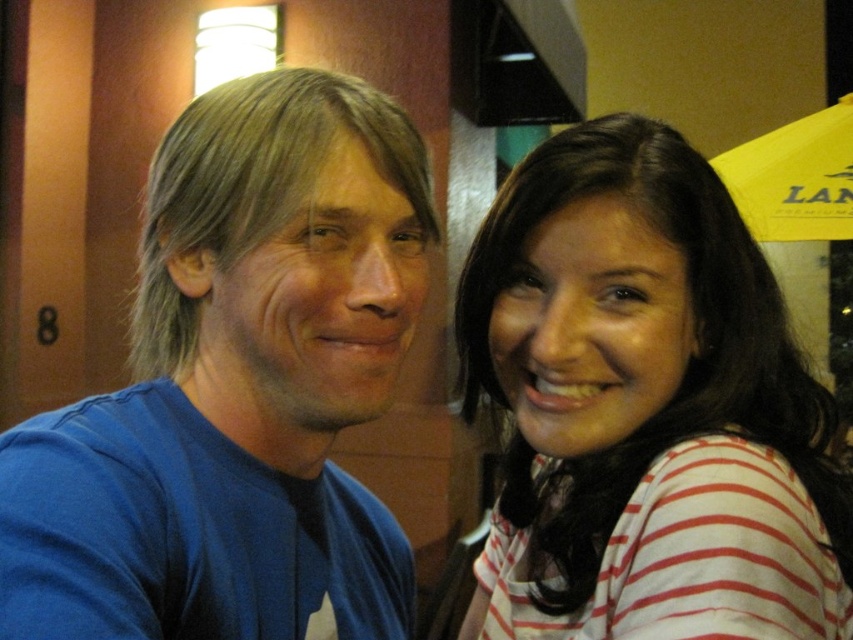
Question: Is blue cotton shirt at left to the left of white striped shirt at right from the viewer's perspective?

Choices:
 (A) no
 (B) yes

Answer: (B)

Question: Which point is closer to the camera?

Choices:
 (A) yellow fabric umbrella at upper right
 (B) blue cotton shirt at left

Answer: (B)

Question: Which point is closer to the camera?

Choices:
 (A) (283, 532)
 (B) (589, 444)

Answer: (A)

Question: Considering the relative positions of blue cotton shirt at left and yellow fabric umbrella at upper right in the image provided, where is blue cotton shirt at left located with respect to yellow fabric umbrella at upper right?

Choices:
 (A) left
 (B) right

Answer: (A)

Question: Can you confirm if blue cotton shirt at left is positioned to the left of white striped shirt at right?

Choices:
 (A) yes
 (B) no

Answer: (A)

Question: Among these points, which one is nearest to the camera?

Choices:
 (A) (798, 470)
 (B) (793, 132)
 (C) (194, 625)

Answer: (C)